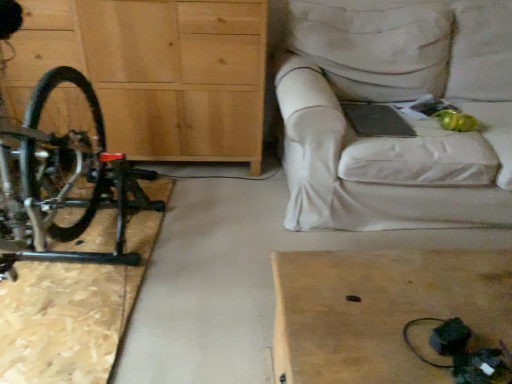
Locate an element on the screen. The image size is (512, 384). free space above light brown wooden table at lower right (from a real-world perspective) is located at coordinates (412, 297).